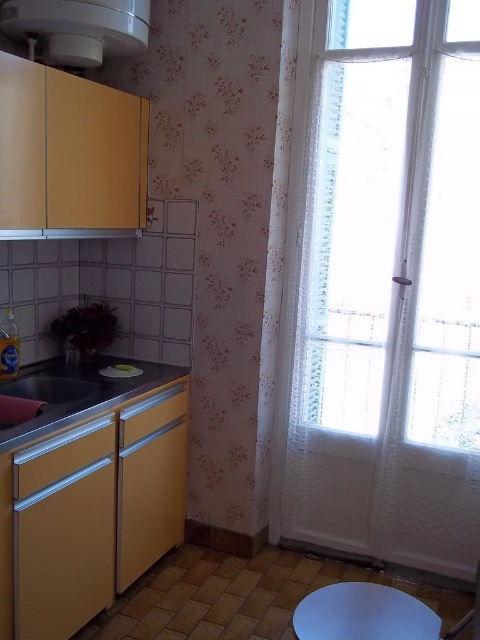
Question: Among these points, which one is nearest to the camera?

Choices:
 (A) (368, 404)
 (B) (0, 387)

Answer: (B)

Question: Is the position of white glossy exhaust hood at upper left more distant than that of matte silver sink at lower left?

Choices:
 (A) no
 (B) yes

Answer: (A)

Question: Among these objects, which one is farthest from the camera?

Choices:
 (A) white sheer curtain at right
 (B) metallic gray counter top at lower center
 (C) matte silver sink at lower left
 (D) white matte stool at lower center

Answer: (C)

Question: Can you confirm if white sheer curtain at right is positioned above metallic gray counter top at lower center?

Choices:
 (A) no
 (B) yes

Answer: (B)

Question: Which point is closer to the camera?

Choices:
 (A) white sheer curtain at right
 (B) metallic gray counter top at lower center

Answer: (B)

Question: Can you confirm if white glossy exhaust hood at upper left is smaller than matte silver sink at lower left?

Choices:
 (A) yes
 (B) no

Answer: (B)